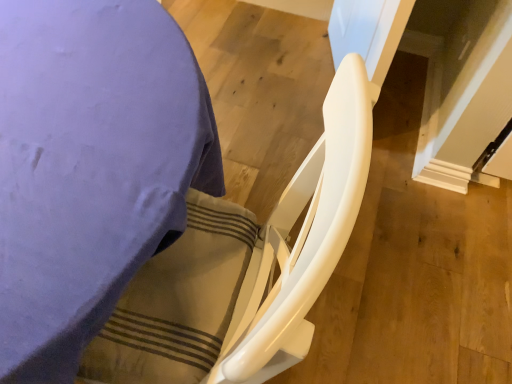
The width and height of the screenshot is (512, 384). I want to click on white glossy chair at lower right, so click(x=90, y=167).

The image size is (512, 384). What do you see at coordinates (90, 167) in the screenshot?
I see `white glossy chair at lower right` at bounding box center [90, 167].

Measure the distance between point (38, 234) and camera.

A distance of 21.77 inches exists between point (38, 234) and camera.

This screenshot has width=512, height=384. What do you see at coordinates (243, 269) in the screenshot?
I see `white glossy rocking chair at center` at bounding box center [243, 269].

Where is `white glossy rocking chair at center`? This screenshot has width=512, height=384. white glossy rocking chair at center is located at coordinates (243, 269).

What is the approximate height of white glossy rocking chair at center?

92.22 centimeters.

The image size is (512, 384). What are the coordinates of `white glossy chair at lower right` in the screenshot? It's located at (90, 167).

Which is more to the right, white glossy chair at lower right or white glossy rocking chair at center?

Positioned to the right is white glossy rocking chair at center.

Considering the relative positions of white glossy chair at lower right and white glossy rocking chair at center in the image provided, is white glossy chair at lower right behind white glossy rocking chair at center?

That is True.

Considering the points (38, 249) and (155, 314), which point is behind, point (38, 249) or point (155, 314)?

The point (155, 314) is farther.

From the image's perspective, relative to white glossy rocking chair at center, is white glossy chair at lower right above or below?

Clearly, from the image's perspective, white glossy chair at lower right is above white glossy rocking chair at center.

From the picture: From a real-world perspective, is white glossy chair at lower right physically above white glossy rocking chair at center?

No.

Is white glossy chair at lower right wider than white glossy rocking chair at center?

Yes, white glossy chair at lower right is wider than white glossy rocking chair at center.

Considering the sizes of objects white glossy chair at lower right and white glossy rocking chair at center in the image provided, who is taller, white glossy chair at lower right or white glossy rocking chair at center?

With more height is white glossy rocking chair at center.

Considering the relative sizes of white glossy chair at lower right and white glossy rocking chair at center in the image provided, is white glossy chair at lower right bigger than white glossy rocking chair at center?

Correct, white glossy chair at lower right is larger in size than white glossy rocking chair at center.

Can we say white glossy chair at lower right lies outside white glossy rocking chair at center?

white glossy chair at lower right lies outside white glossy rocking chair at center's area.

Looking at this image, is white glossy chair at lower right next to white glossy rocking chair at center?

No, white glossy chair at lower right is not making contact with white glossy rocking chair at center.

Is white glossy chair at lower right facing towards white glossy rocking chair at center?

→ Yes, white glossy chair at lower right is turned towards white glossy rocking chair at center.

This screenshot has width=512, height=384. Identify the location of furniture that is behind the white glossy rocking chair at center. (90, 167).

Would you say white glossy rocking chair at center is to the left or to the right of white glossy chair at lower right in the picture?

Based on their positions, white glossy rocking chair at center is located to the right of white glossy chair at lower right.

Considering the positions of objects white glossy rocking chair at center and white glossy chair at lower right in the image provided, who is in front, white glossy rocking chair at center or white glossy chair at lower right?

white glossy rocking chair at center is more forward.

Does point (91, 372) come farther from viewer compared to point (14, 359)?

Yes.

From the image's perspective, is white glossy rocking chair at center below white glossy chair at lower right?

Yes, from the image's perspective, white glossy rocking chair at center is beneath white glossy chair at lower right.

From a real-world perspective, who is located lower, white glossy rocking chair at center or white glossy chair at lower right?

white glossy chair at lower right, from a real-world perspective.

Does white glossy rocking chair at center have a greater width compared to white glossy chair at lower right?

Incorrect, the width of white glossy rocking chair at center does not surpass that of white glossy chair at lower right.

Between white glossy rocking chair at center and white glossy chair at lower right, which one has more height?

With more height is white glossy rocking chair at center.

Is white glossy rocking chair at center bigger or smaller than white glossy chair at lower right?

Considering their sizes, white glossy rocking chair at center takes up less space than white glossy chair at lower right.

Choose the correct answer: Is white glossy rocking chair at center inside white glossy chair at lower right or outside it?

white glossy rocking chair at center can be found inside white glossy chair at lower right.

Is white glossy rocking chair at center next to white glossy chair at lower right and touching it?

white glossy rocking chair at center and white glossy chair at lower right are clearly separated.

Could you tell me if white glossy rocking chair at center is turned towards white glossy chair at lower right?

Yes, white glossy rocking chair at center faces towards white glossy chair at lower right.

This screenshot has height=384, width=512. I want to click on rocking chair below the white glossy chair at lower right (from the image's perspective), so click(243, 269).

The height and width of the screenshot is (384, 512). Identify the location of rocking chair in front of the white glossy chair at lower right. (243, 269).

In the image, there is a white glossy rocking chair at center. In order to click on furniture above it (from the image's perspective) in this screenshot , I will do `click(90, 167)`.